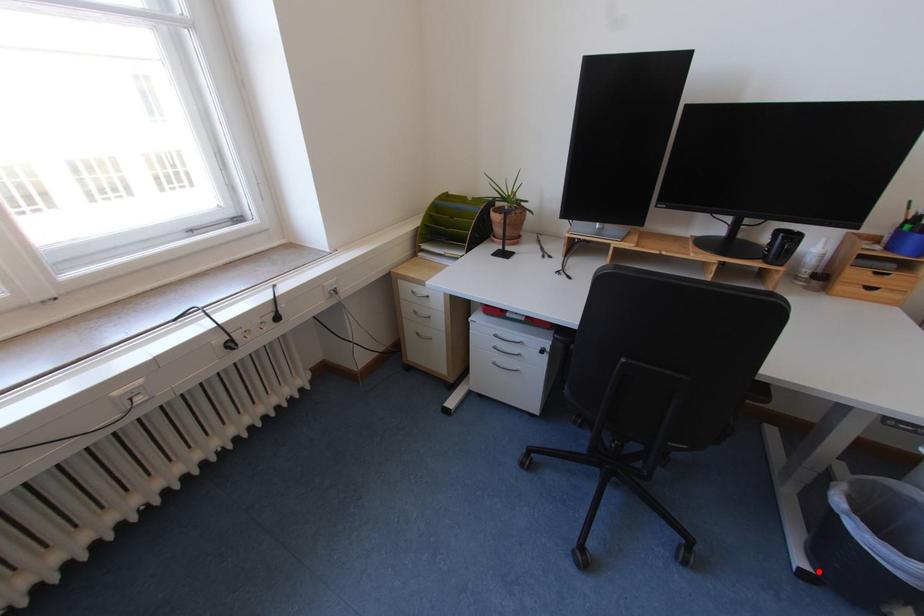
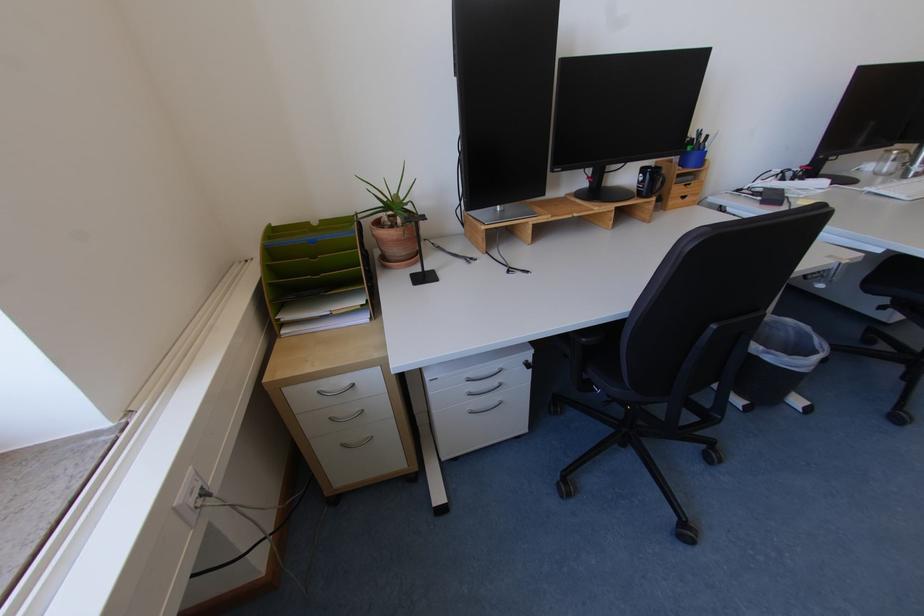
In the second image, find the point that corresponds to the highlighted location in the first image.

(755, 403)